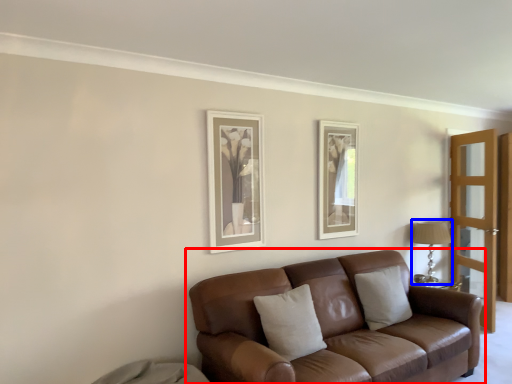
Question: Among these objects, which one is farthest to the camera, studio couch (highlighted by a red box) or table lamp (highlighted by a blue box)?

Choices:
 (A) studio couch
 (B) table lamp

Answer: (B)